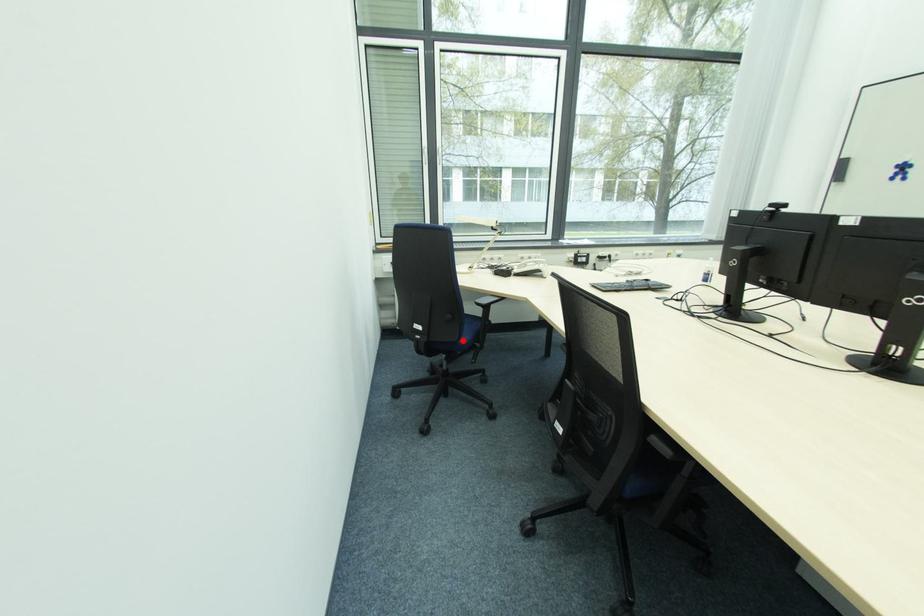
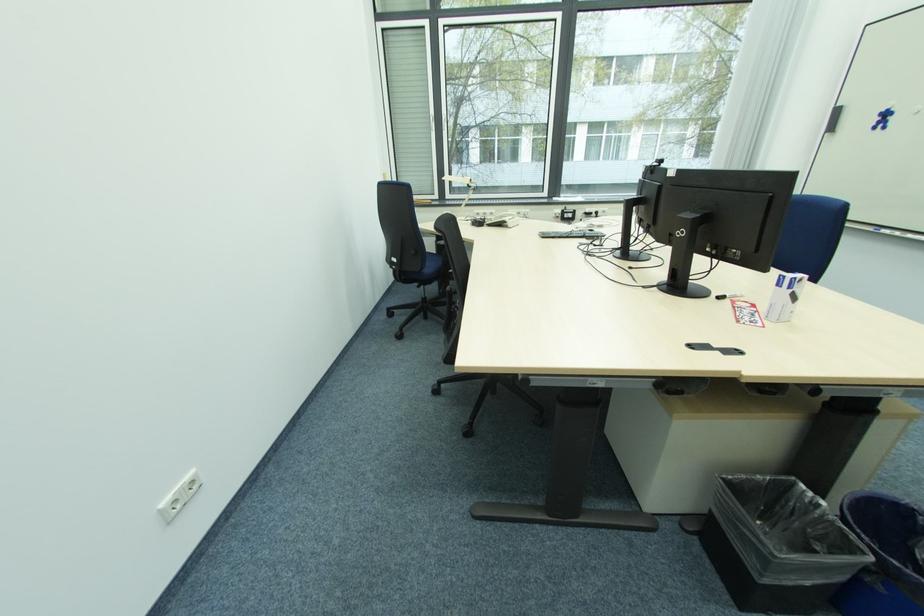
Find the pixel in the second image that matches the highlighted location in the first image.

(427, 272)